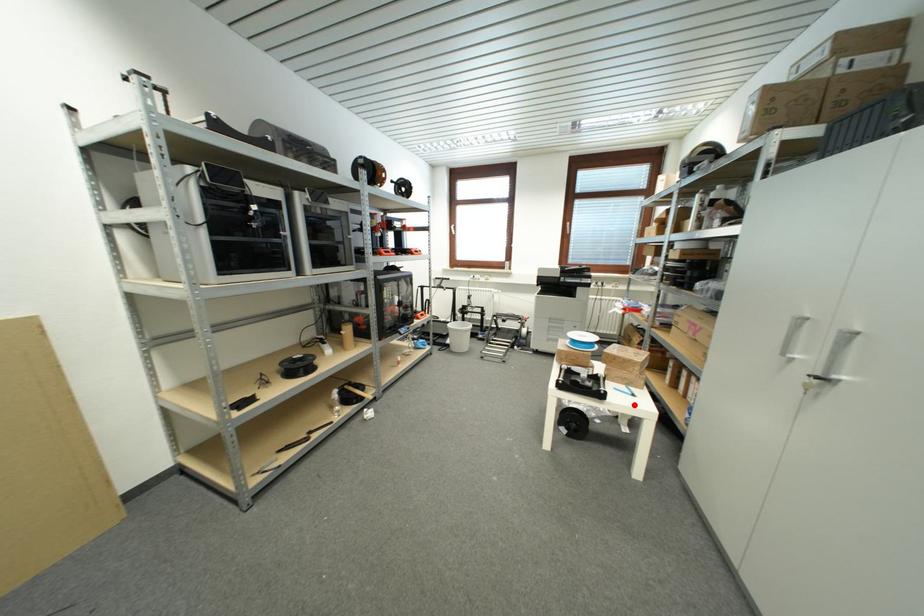
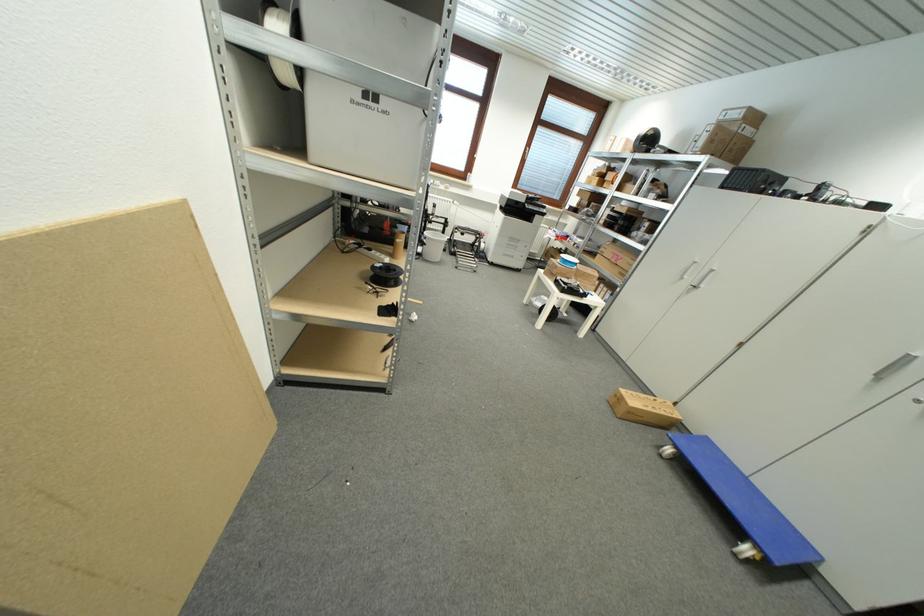
The point at the highlighted location is marked in the first image. Where is the corresponding point in the second image?

(599, 301)